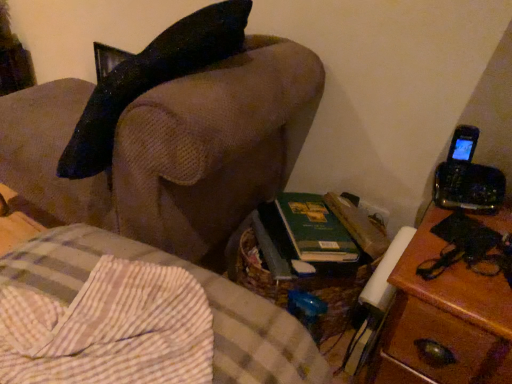
This screenshot has width=512, height=384. Identify the location of vacant space situated above brown woven basket at lower center, placed as the 1th furniture when sorted from bottom to top (from a real-world perspective). coord(113,308).